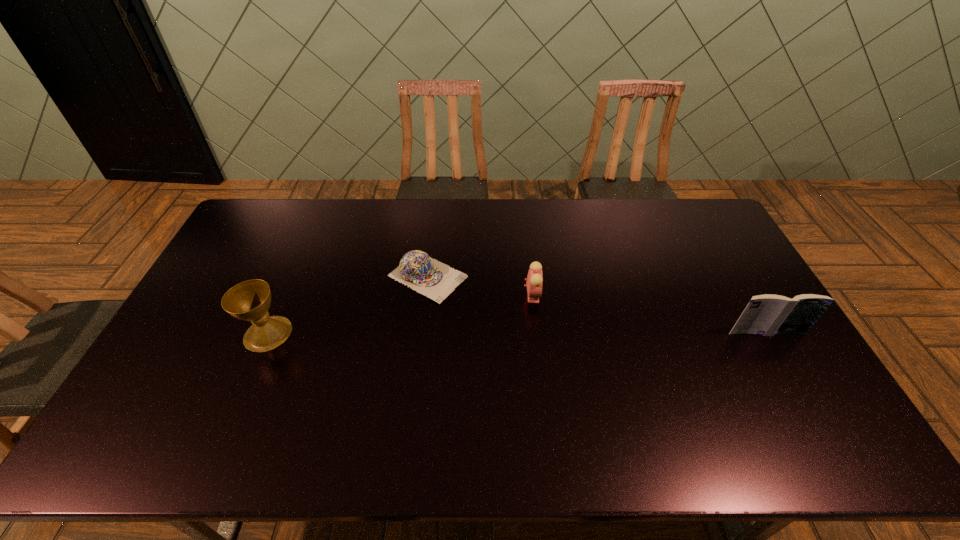
In order to click on object that stands as the third closest to the second shortest object in this screenshot , I will do `click(250, 300)`.